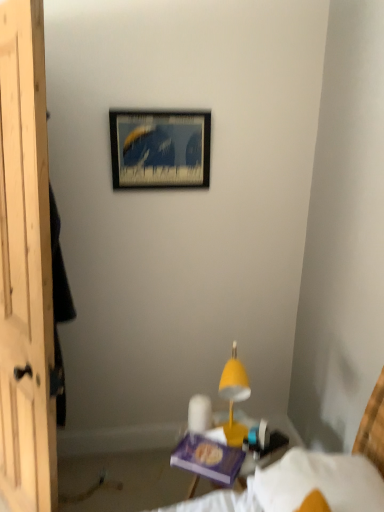
Question: From a real-world perspective, is wooden picture frame at upper center positioned above or below white fabric bed at lower right?

Choices:
 (A) above
 (B) below

Answer: (A)

Question: Is wooden picture frame at upper center situated inside white fabric bed at lower right or outside?

Choices:
 (A) outside
 (B) inside

Answer: (A)

Question: Which is farther from the white fabric bed at lower right?

Choices:
 (A) yellow matte table lamp at center
 (B) wooden picture frame at upper center

Answer: (B)

Question: Estimate the real-world distances between objects in this image. Which object is farther from the wooden picture frame at upper center?

Choices:
 (A) white fabric bed at lower right
 (B) yellow matte table lamp at center

Answer: (A)